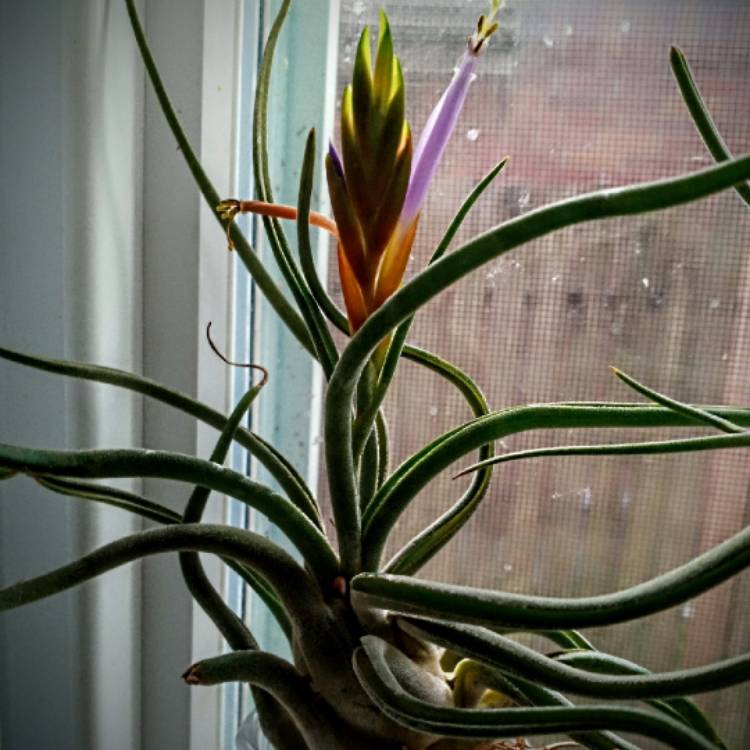
Locate an element on the screen. The image size is (750, 750). plant is located at coordinates (361, 694).